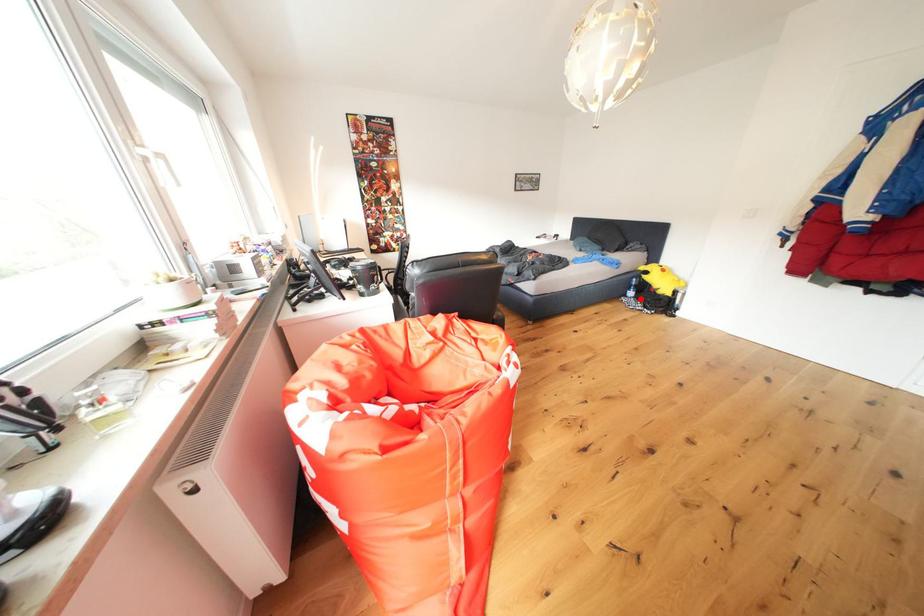
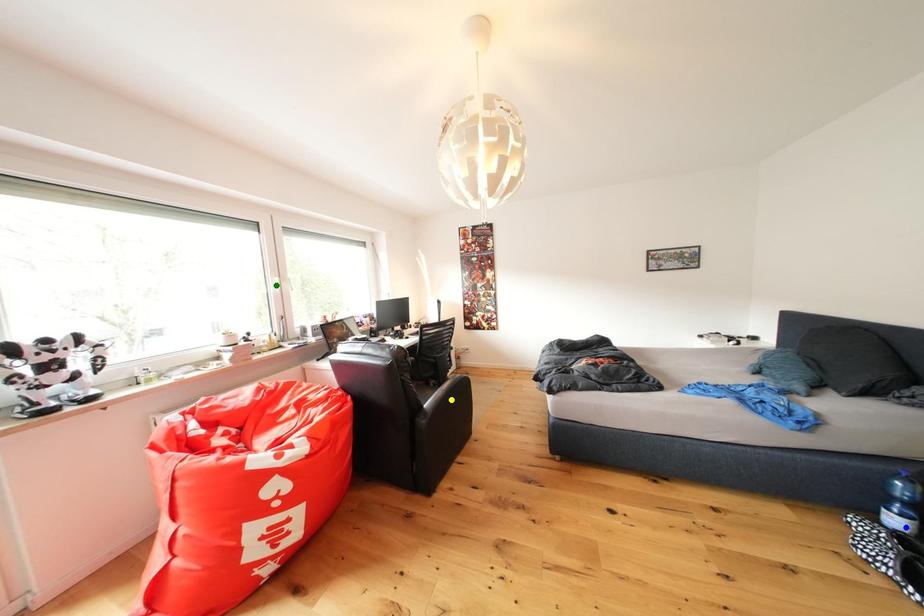
Question: I am providing you with two images of the same scene from different viewpoints. A red point is marked on the first image. You are given multiple points on the second image. Which point in image 2 represents the same 3d spot as the red point in image 1?

Choices:
 (A) green point
 (B) blue point
 (C) yellow point

Answer: (B)